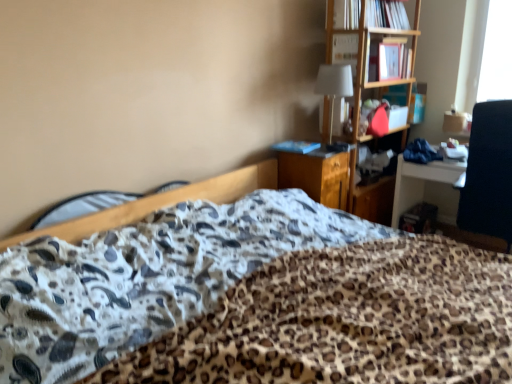
Question: Is white fabric lampshade at upper center inside blue matte book at center, the third book when ordered from top to bottom?

Choices:
 (A) no
 (B) yes

Answer: (A)

Question: Is blue matte book at center, the first book when ordered from bottom to top, bigger than white fabric lampshade at upper center?

Choices:
 (A) yes
 (B) no

Answer: (B)

Question: Is white fabric lampshade at upper center at the back of blue matte book at center, positioned as the first book in left-to-right order?

Choices:
 (A) no
 (B) yes

Answer: (A)

Question: Considering the relative sizes of blue matte book at center, which is counted as the 3th book, starting from the right, and white fabric lampshade at upper center in the image provided, is blue matte book at center, which is counted as the 3th book, starting from the right, thinner than white fabric lampshade at upper center?

Choices:
 (A) no
 (B) yes

Answer: (B)

Question: Is blue matte book at center, positioned as the first book in left-to-right order, positioned far away from white fabric lampshade at upper center?

Choices:
 (A) no
 (B) yes

Answer: (A)

Question: Would you say matte pink book at upper right, arranged as the 2th book when ordered from the bottom, is to the left or to the right of wooden file cabinet at center in the picture?

Choices:
 (A) right
 (B) left

Answer: (A)

Question: From a real-world perspective, relative to wooden file cabinet at center, is matte pink book at upper right, the 1th book when ordered from right to left, vertically above or below?

Choices:
 (A) below
 (B) above

Answer: (B)

Question: Considering their positions, is matte pink book at upper right, arranged as the 2th book when ordered from the bottom, located in front of or behind wooden file cabinet at center?

Choices:
 (A) behind
 (B) front

Answer: (A)

Question: From the image's perspective, is matte pink book at upper right, arranged as the 2th book when ordered from the bottom, located above or below wooden file cabinet at center?

Choices:
 (A) above
 (B) below

Answer: (A)

Question: Considering their positions, is wooden file cabinet at center located in front of or behind hardcover book at upper right, which ranks as the 2th book in left-to-right order?

Choices:
 (A) front
 (B) behind

Answer: (A)

Question: Considering the positions of point (309, 172) and point (397, 11), is point (309, 172) closer or farther from the camera than point (397, 11)?

Choices:
 (A) closer
 (B) farther

Answer: (A)

Question: In terms of height, does wooden file cabinet at center look taller or shorter compared to hardcover book at upper right, the first book from the top?

Choices:
 (A) short
 (B) tall

Answer: (B)

Question: Looking at their shapes, would you say wooden file cabinet at center is wider or thinner than hardcover book at upper right, the first book from the top?

Choices:
 (A) wide
 (B) thin

Answer: (A)

Question: Is white fabric lampshade at upper center to the left or to the right of wooden file cabinet at center in the image?

Choices:
 (A) left
 (B) right

Answer: (B)

Question: Considering the positions of point (329, 137) and point (302, 170), is point (329, 137) closer or farther from the camera than point (302, 170)?

Choices:
 (A) farther
 (B) closer

Answer: (A)